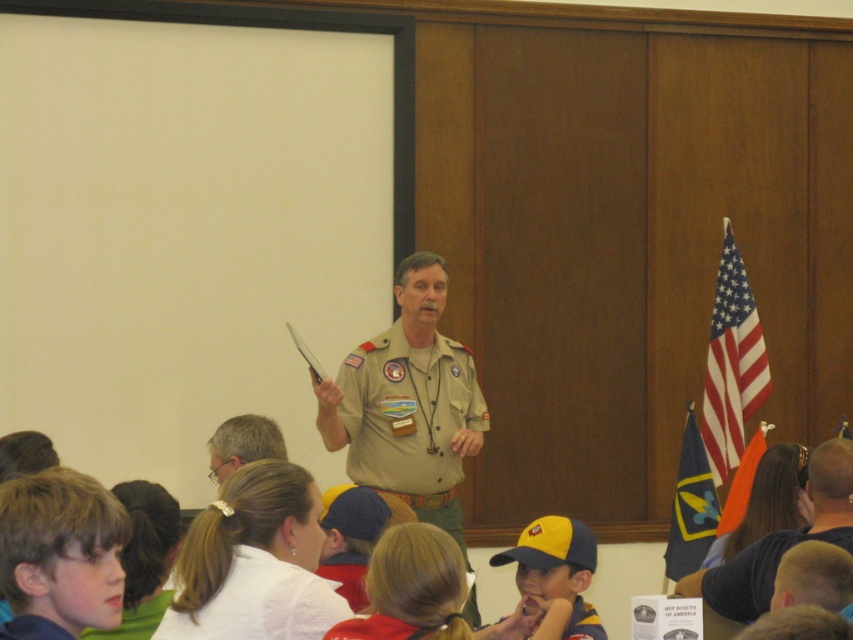
Question: Is matte black shirt at center positioned in front of gray hair at upper center?

Choices:
 (A) yes
 (B) no

Answer: (B)

Question: Which is nearer to the khaki uniform at center?

Choices:
 (A) american flag at right
 (B) yellow fabric cap at lower right
 (C) blue fabric flag at right

Answer: (C)

Question: Among these objects, which one is farthest from the camera?

Choices:
 (A) american flag at right
 (B) gray hair at upper center
 (C) blue fabric flag at right
 (D) smooth white shirt at center

Answer: (A)

Question: Is smooth white shirt at center behind yellow fabric cap at lower center?

Choices:
 (A) no
 (B) yes

Answer: (A)

Question: Which point is closer to the camera?

Choices:
 (A) (22, 518)
 (B) (274, 440)

Answer: (A)

Question: Can you confirm if blonde hair at lower left is wider than gray hair at upper center?

Choices:
 (A) no
 (B) yes

Answer: (A)